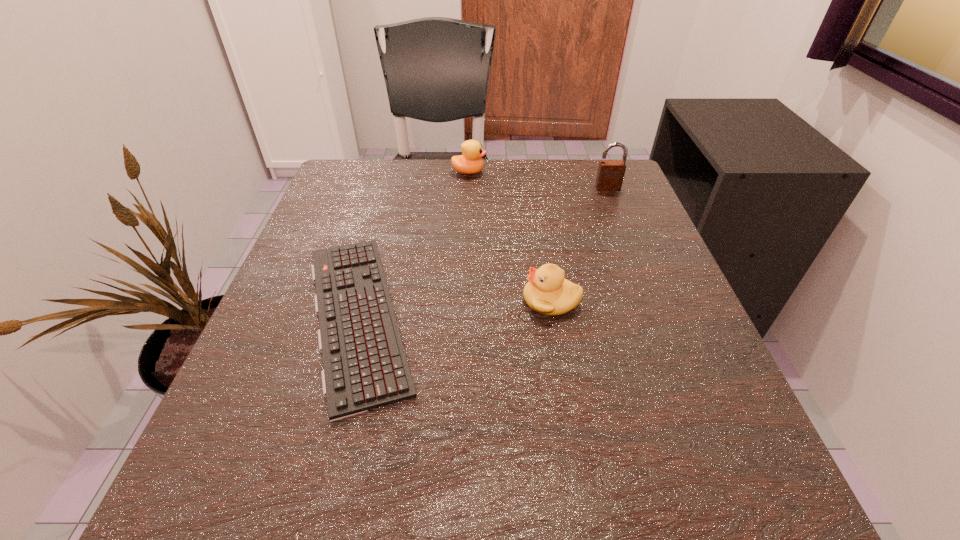
Locate an element on the screen. the rightmost object is located at coordinates (610, 175).

Find the location of a particular element. padlock is located at coordinates (610, 175).

Locate an element on the screen. the farthest object is located at coordinates (470, 162).

The image size is (960, 540). Identify the location of the farther duckling. (470, 162).

Identify the location of the nearer duckling. (547, 292).

Locate an element on the screen. Image resolution: width=960 pixels, height=540 pixels. the second object from right to left is located at coordinates (547, 292).

The height and width of the screenshot is (540, 960). In order to click on computer keyboard in this screenshot , I will do `click(365, 366)`.

At what (x,y) coordinates should I click in order to perform the action: click on the shortest object. Please return your answer as a coordinate pair (x, y). The height and width of the screenshot is (540, 960). Looking at the image, I should click on (365, 366).

Find the location of a particular element. vacant space positioned on the front-facing side of the rightmost object is located at coordinates (628, 238).

At what (x,y) coordinates should I click in order to perform the action: click on vacant area located 0.080m on the face of the farther duckling. Please return your answer as a coordinate pair (x, y). The image size is (960, 540). Looking at the image, I should click on (518, 172).